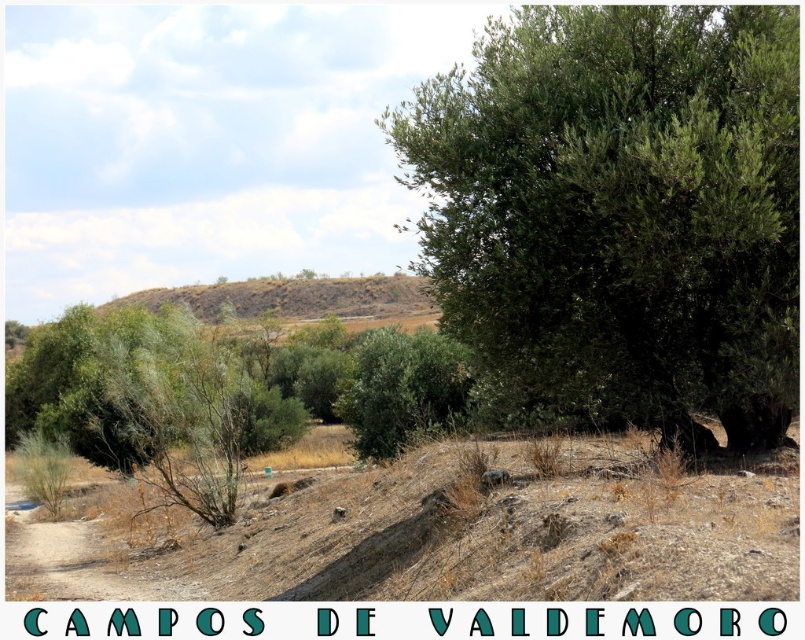
Is brown dry soil at center thinner than brown/dry soil hill at upper center?

Correct, brown dry soil at center's width is less than brown/dry soil hill at upper center's.

Does brown dry soil at center have a smaller size compared to brown/dry soil hill at upper center?

Correct, brown dry soil at center occupies less space than brown/dry soil hill at upper center.

What do you see at coordinates (436, 532) in the screenshot? I see `brown dry soil at center` at bounding box center [436, 532].

Find the location of `brown dry soil at center`. brown dry soil at center is located at coordinates (436, 532).

Can you confirm if green leafy tree at upper right is smaller than brown/dry soil hill at upper center?

Incorrect, green leafy tree at upper right is not smaller in size than brown/dry soil hill at upper center.

Between point (667, 349) and point (389, 291), which one is positioned behind?

Point (389, 291)

Find the location of a particular element. green leafy tree at upper right is located at coordinates (622, 209).

Does green leafy tree at upper right have a lesser height compared to brown dry soil at center?

In fact, green leafy tree at upper right may be taller than brown dry soil at center.

Is the position of green leafy tree at upper right less distant than that of brown dry soil at center?

No, green leafy tree at upper right is further to the viewer.

You are a GUI agent. You are given a task and a screenshot of the screen. Output one action in this format:
    pyautogui.click(x=<x>, y=<y>)
    Task: Click on the green leafy tree at upper right
    This screenshot has width=805, height=640.
    Given the screenshot: What is the action you would take?
    pyautogui.click(x=622, y=209)